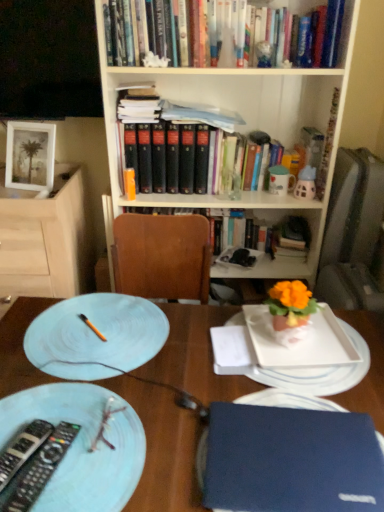
Where is `empty space that is in between black plastic remote control at lower left and light blue ceramic plate at center-left, the second plate from the bottom`? empty space that is in between black plastic remote control at lower left and light blue ceramic plate at center-left, the second plate from the bottom is located at coordinates click(68, 413).